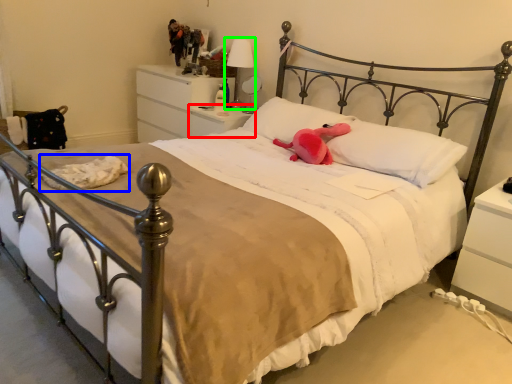
Question: Based on their relative distances, which object is nearer to nightstand (highlighted by a red box)? Choose from material (highlighted by a blue box) and table lamp (highlighted by a green box).

Choices:
 (A) material
 (B) table lamp

Answer: (B)